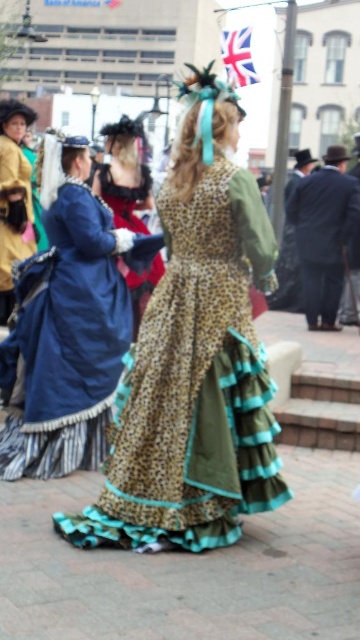
Can you confirm if leopard print fabric dress at center is taller than leopard print dress at center?

No, leopard print fabric dress at center is not taller than leopard print dress at center.

Is point (209, 440) positioned in front of point (60, 429)?

That is True.

Is point (214, 168) farther from viewer compared to point (59, 468)?

No.

I want to click on leopard print fabric dress at center, so click(194, 385).

Is velvet red dress at center to the left of matte yellow coat at left from the viewer's perspective?

In fact, velvet red dress at center is to the right of matte yellow coat at left.

Between velvet red dress at center and matte yellow coat at left, which one appears on the left side from the viewer's perspective?

matte yellow coat at left

This screenshot has width=360, height=640. What do you see at coordinates (123, 176) in the screenshot?
I see `velvet red dress at center` at bounding box center [123, 176].

Where is `velvet red dress at center`? velvet red dress at center is located at coordinates (123, 176).

Can you confirm if leopard print fabric dress at center is smaller than velvet red dress at center?

No, leopard print fabric dress at center is not smaller than velvet red dress at center.

Between leopard print fabric dress at center and velvet red dress at center, which one has less height?

Standing shorter between the two is velvet red dress at center.

This screenshot has height=640, width=360. In order to click on leopard print fabric dress at center in this screenshot , I will do `click(194, 385)`.